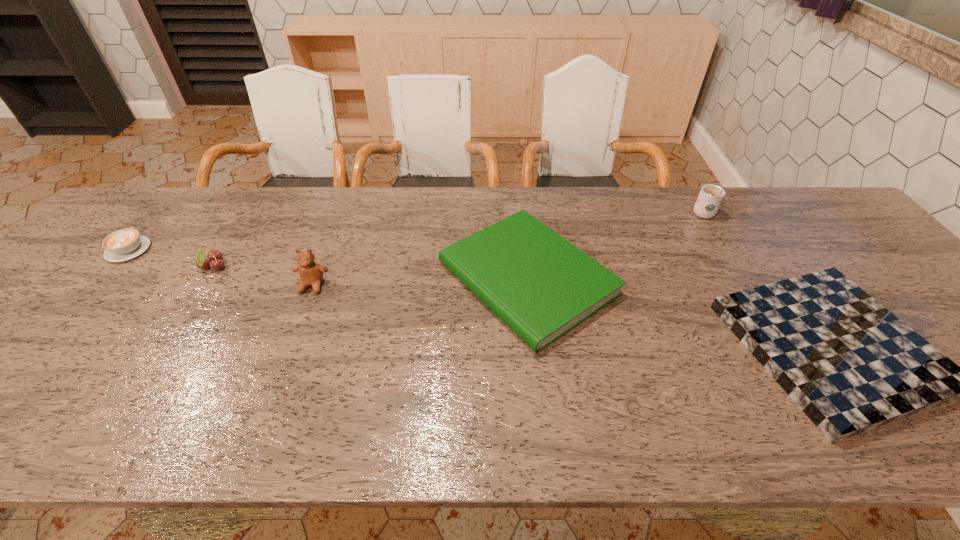
Locate an element on the screen. The height and width of the screenshot is (540, 960). free space located on the right of the fourth object from left to right is located at coordinates (683, 278).

The image size is (960, 540). Identify the location of vacant space located on the side of the cappuccino with the handle. (179, 191).

You are a GUI agent. You are given a task and a screenshot of the screen. Output one action in this format:
    pyautogui.click(x=<x>, y=<y>)
    Task: Click on the vacant region located on the side of the cappuccino with the handle
    
    Given the screenshot: What is the action you would take?
    pyautogui.click(x=171, y=199)

The width and height of the screenshot is (960, 540). I want to click on free point located on the side of the cappuccino with the handle, so click(x=179, y=191).

This screenshot has height=540, width=960. Find the location of `cup that is at the far edge`. cup that is at the far edge is located at coordinates (710, 197).

Identify the location of paperback book that is positioned at the far edge. This screenshot has height=540, width=960. (540, 285).

Where is `object located at the left edge`? object located at the left edge is located at coordinates (125, 244).

This screenshot has height=540, width=960. Identify the location of vacant area at the far edge. click(x=491, y=206).

This screenshot has width=960, height=540. In the image, there is a desktop. Find the location of `free space at the near edge`. free space at the near edge is located at coordinates (14, 433).

At what (x,y) coordinates should I click in order to perform the action: click on vacant area at the left edge of the desktop. Please return your answer as a coordinate pair (x, y). The width and height of the screenshot is (960, 540). Looking at the image, I should click on (134, 264).